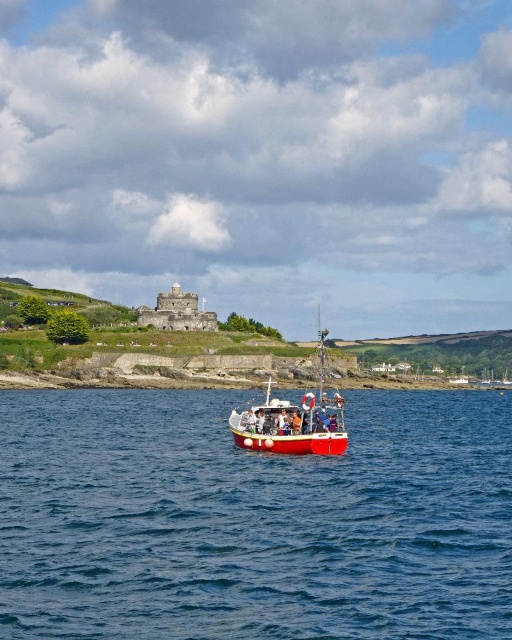
Question: Which object appears farthest from the camera in this image?

Choices:
 (A) blue water at center
 (B) red matte boat at center

Answer: (B)

Question: Is blue water at center positioned in front of red matte boat at center?

Choices:
 (A) no
 (B) yes

Answer: (B)

Question: Is blue water at center thinner than red matte boat at center?

Choices:
 (A) yes
 (B) no

Answer: (B)

Question: Can you confirm if blue water at center is positioned to the right of red matte boat at center?

Choices:
 (A) no
 (B) yes

Answer: (B)

Question: Among these points, which one is nearest to the camera?

Choices:
 (A) (297, 444)
 (B) (177, 520)

Answer: (B)